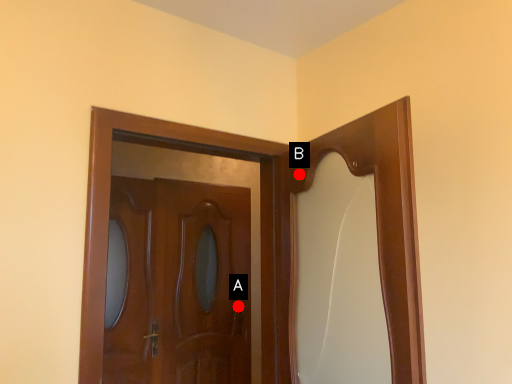
Question: Two points are circled on the image, labeled by A and B beside each circle. Which point is farther to the camera?

Choices:
 (A) A is further
 (B) B is further

Answer: (A)